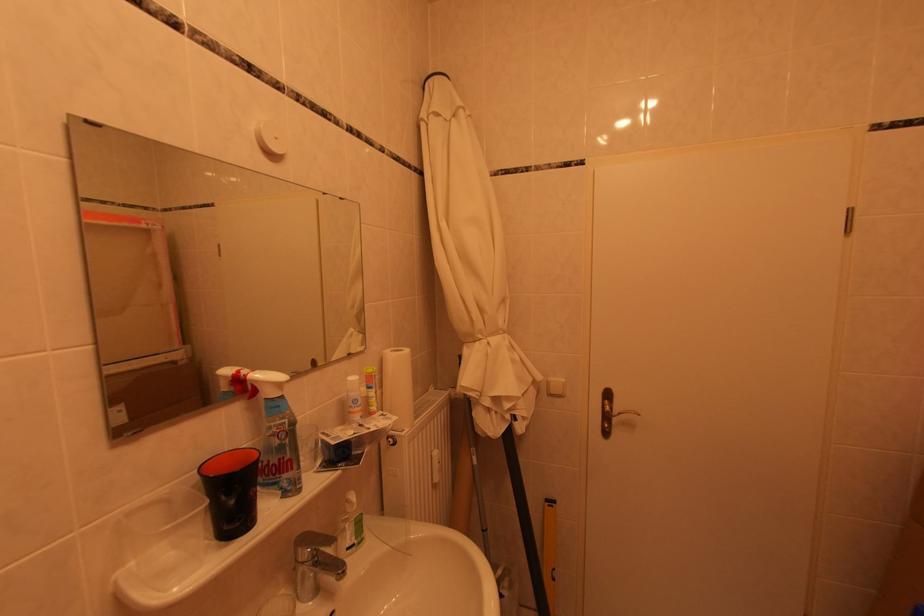
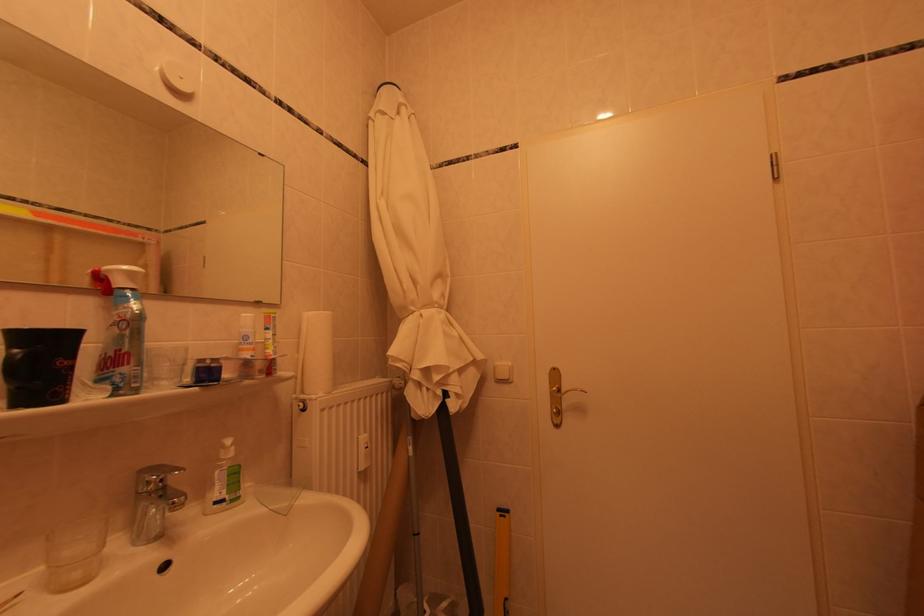
Question: The images are taken continuously from a first-person perspective. In which direction are you moving?

Choices:
 (A) Left
 (B) Right
 (C) Forward
 (D) Backward

Answer: (B)